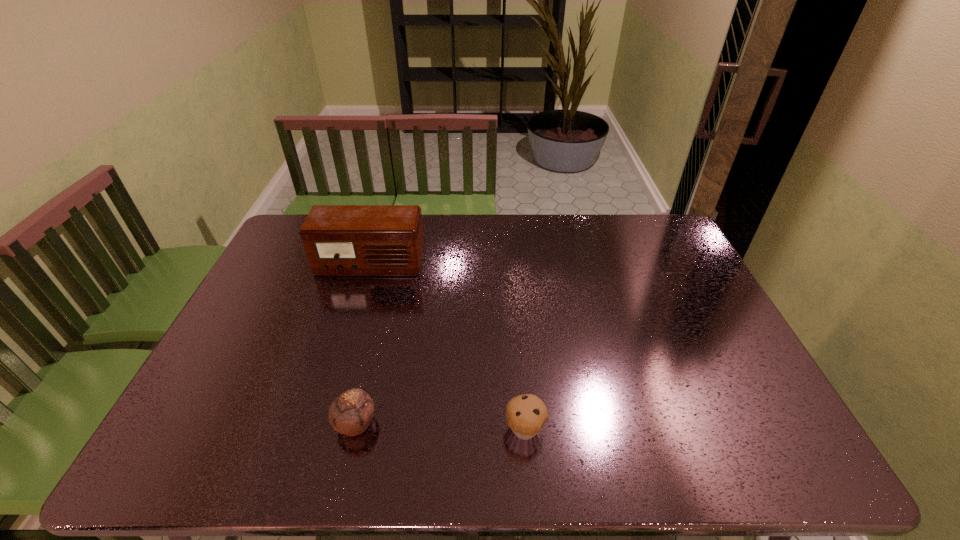
The height and width of the screenshot is (540, 960). I want to click on vacant area between the rightmost object and the tallest object, so click(x=447, y=347).

Identify the location of object that can be found as the closest to the left muffin. The height and width of the screenshot is (540, 960). (526, 414).

What are the coordinates of `object that ranks as the second closest to the farthest object` in the screenshot? It's located at (526, 414).

I want to click on free space that satisfies the following two spatial constraints: 1. on the front-facing side of the right muffin; 2. on the left side of the tallest object, so click(321, 429).

Locate an element on the screen. free region that satisfies the following two spatial constraints: 1. on the front side of the left muffin; 2. on the left side of the right muffin is located at coordinates (354, 429).

Locate an element on the screen. This screenshot has height=540, width=960. vacant space that satisfies the following two spatial constraints: 1. on the front-facing side of the radio receiver; 2. on the right side of the left muffin is located at coordinates (323, 423).

Where is `vacant area in the image that satisfies the following two spatial constraints: 1. on the front-facing side of the tallest object; 2. on the left side of the right muffin`? vacant area in the image that satisfies the following two spatial constraints: 1. on the front-facing side of the tallest object; 2. on the left side of the right muffin is located at coordinates (321, 429).

What are the coordinates of `free space that satisfies the following two spatial constraints: 1. on the front-facing side of the radio receiver; 2. on the right side of the left muffin` in the screenshot? It's located at (323, 423).